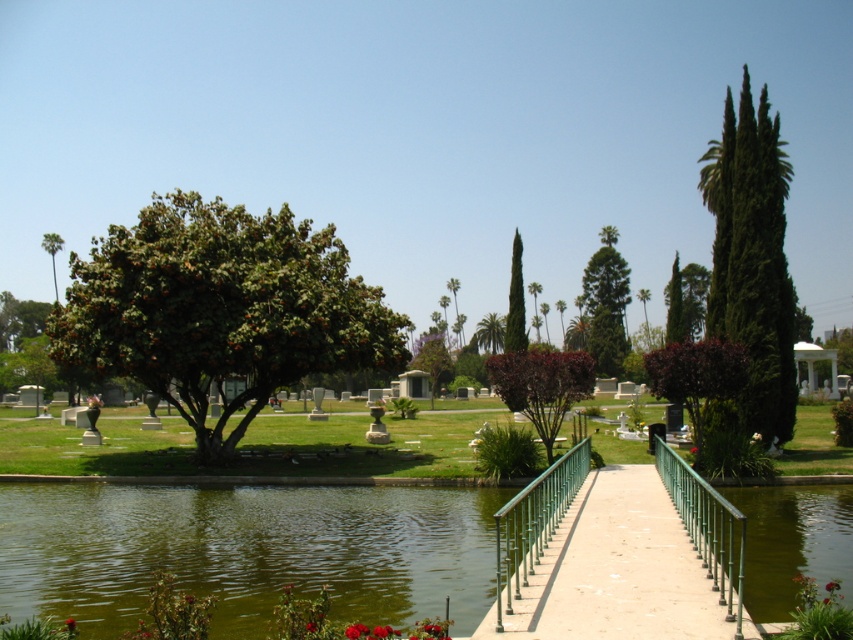
Question: Which object appears farthest from the camera in this image?

Choices:
 (A) green textured tree at center
 (B) vibrant red petals at center
 (C) green leafy tree at center
 (D) green coniferous tree at right

Answer: (A)

Question: From the image, what is the correct spatial relationship of green leafy tree at center in relation to green leafy palm tree at upper left?

Choices:
 (A) right
 (B) left

Answer: (A)

Question: From the image, what is the correct spatial relationship of green coniferous tree at right in relation to vibrant red petals at center?

Choices:
 (A) above
 (B) below

Answer: (A)

Question: Based on their relative distances, which object is farther from the vibrant red petals at center?

Choices:
 (A) green leafy palm tree at upper left
 (B) green leafy tree at center

Answer: (A)

Question: Which object is farther from the camera taking this photo?

Choices:
 (A) green metal/rail at center
 (B) vibrant red petals at center

Answer: (B)

Question: Does green leafy palm tree at upper left lie in front of vibrant red petals at center?

Choices:
 (A) yes
 (B) no

Answer: (B)